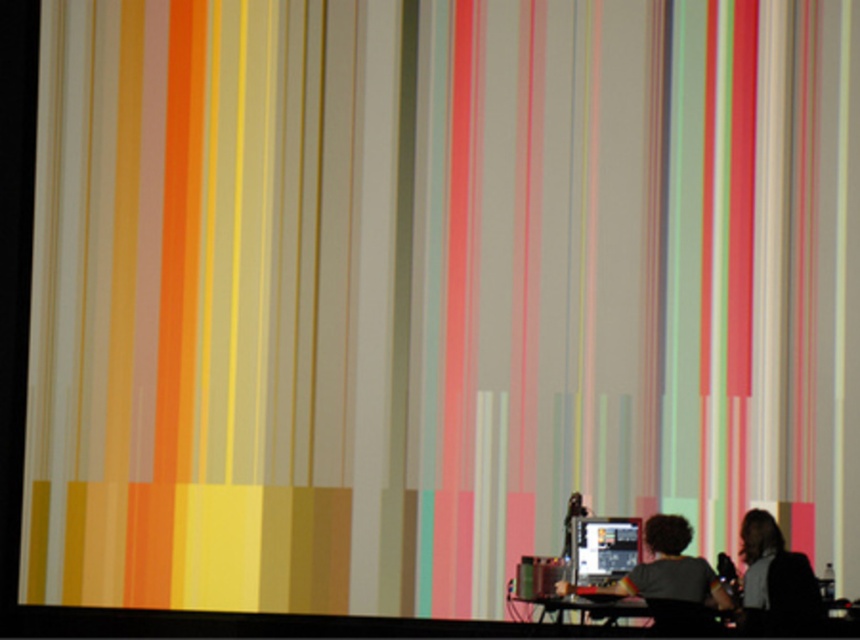
Question: Which of these objects is positioned closest to the dark brown hair at lower right?

Choices:
 (A) matte black monitor at lower center
 (B) black plastic table at lower center
 (C) matte black computer at lower center

Answer: (C)

Question: Can you confirm if dark brown hair at lower right is positioned to the right of black plastic table at lower center?

Choices:
 (A) no
 (B) yes

Answer: (B)

Question: Estimate the real-world distances between objects in this image. Which object is farther from the black plastic table at lower center?

Choices:
 (A) dark brown hair at lower right
 (B) matte black monitor at lower center
 (C) matte black computer at lower center

Answer: (A)

Question: Can you confirm if matte black computer at lower center is thinner than black plastic table at lower center?

Choices:
 (A) yes
 (B) no

Answer: (B)

Question: Does dark brown hair at lower right have a smaller size compared to black plastic table at lower center?

Choices:
 (A) no
 (B) yes

Answer: (B)

Question: Among these points, which one is nearest to the camera?

Choices:
 (A) (607, 516)
 (B) (771, 536)
 (C) (596, 612)

Answer: (C)